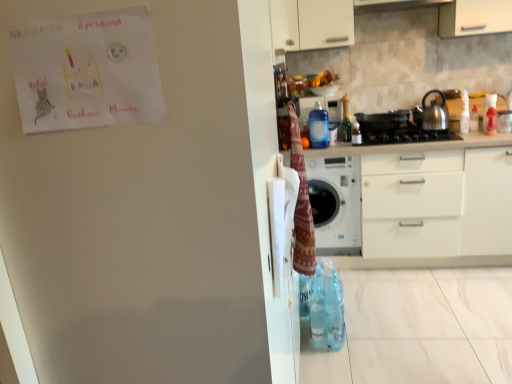
Question: From a real-world perspective, is transparent plastic spray bottle at upper right, the second bottle from the right, positioned above or below translucent plastic bottle at upper right, marked as the third bottle in a right-to-left arrangement?

Choices:
 (A) above
 (B) below

Answer: (B)

Question: Is point (464, 127) positioned closer to the camera than point (343, 97)?

Choices:
 (A) closer
 (B) farther

Answer: (A)

Question: Estimate the real-world distances between objects in this image. Which object is farther from the satin silver kettle at right?

Choices:
 (A) translucent plastic bottle at upper right, marked as the fourth bottle in a left-to-right arrangement
 (B) transparent plastic bottle at upper center, marked as the fourth bottle in a right-to-left arrangement
 (C) metallic black stove at center
 (D) satin black gas stove at center
 (E) white glossy washing machine at center

Answer: (E)

Question: Estimate the real-world distances between objects in this image. Which object is farther from the translucent plastic bottle at upper right, which is the 2th bottle from left to right?

Choices:
 (A) knitted woolen blanket at upper right
 (B) satin black gas stove at center
 (C) satin silver kettle at right
 (D) white glossy washing machine at center
 (E) translucent plastic bottle at upper right, placed as the 1th bottle when sorted from right to left

Answer: (A)